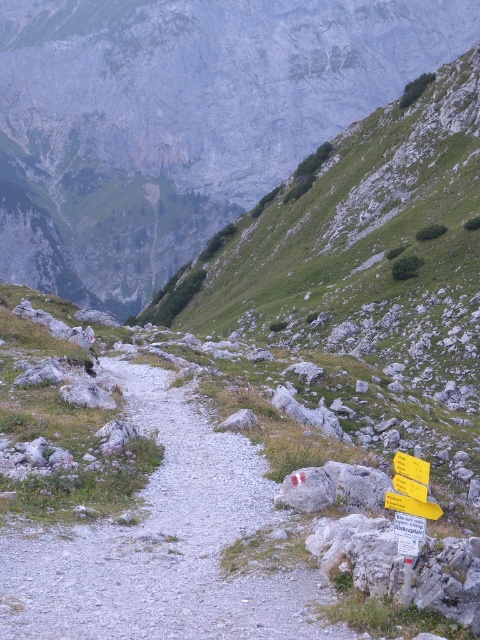
Based on the scene description, where is the green grassy mountain at center located in the image?

The green grassy mountain at center is located at point (180, 120) in the image.

You are a hiker trying to follow the gray gravel path at center. You see a point marked at coordinate (x=163, y=545). Where is this point located in relation to the path?

The point marked at coordinate (x=163, y=545) is located on the gray gravel path at center, as indicated by the description.

You are a hiker planning to take a photo of the green grassy mountain at center and the yellow plastic sign at lower right. Which object should you focus on first if you want both to be in sharp focus?

The green grassy mountain at center is taller than the yellow plastic sign at lower right, so you should focus on the green grassy mountain at center first to ensure both are in sharp focus.